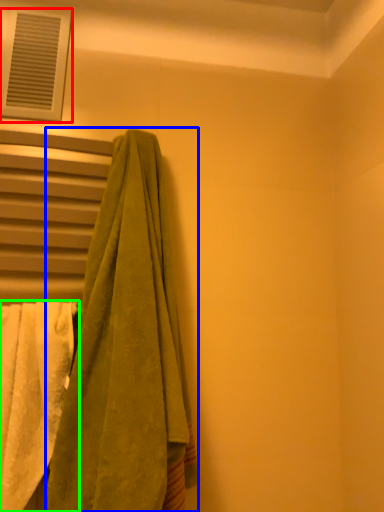
Question: Estimate the real-world distances between objects in this image. Which object is farther from window (highlighted by a red box), towel (highlighted by a blue box) or towel (highlighted by a green box)?

Choices:
 (A) towel
 (B) towel

Answer: (B)